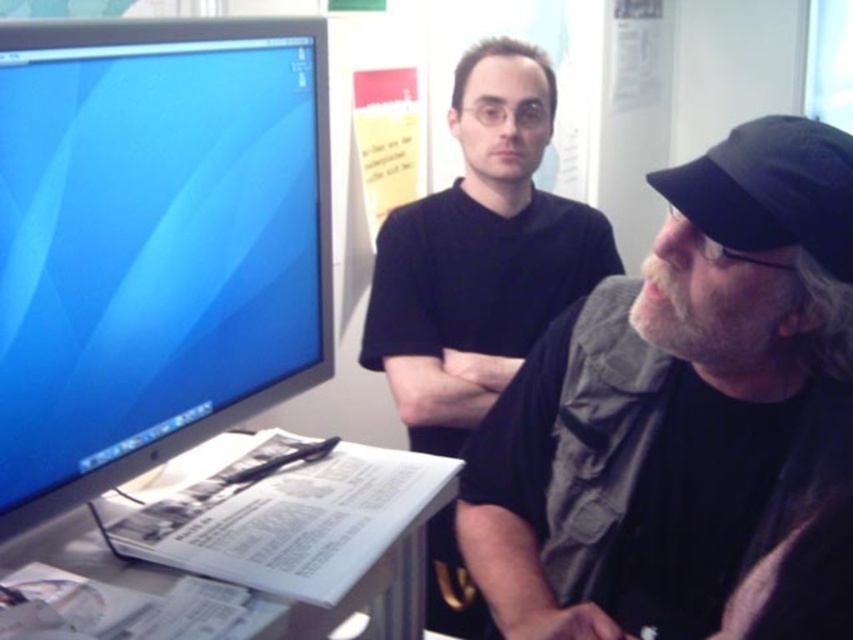
Question: Is the position of dark gray fabric shirt at center more distant than that of white paper at lower center?

Choices:
 (A) no
 (B) yes

Answer: (A)

Question: Which point is closer to the camera?

Choices:
 (A) (161, 484)
 (B) (454, 330)
 (C) (289, 193)
 (D) (537, 381)

Answer: (C)

Question: Which object appears farthest from the camera in this image?

Choices:
 (A) dark gray fabric shirt at center
 (B) white paper at lower center

Answer: (B)

Question: Does dark gray fabric shirt at center appear under black matte shirt at center?

Choices:
 (A) no
 (B) yes

Answer: (B)

Question: Can you confirm if dark gray fabric shirt at center is positioned to the left of black matte shirt at center?

Choices:
 (A) yes
 (B) no

Answer: (B)

Question: Which of the following is the closest to the observer?

Choices:
 (A) (498, 595)
 (B) (173, 378)

Answer: (B)